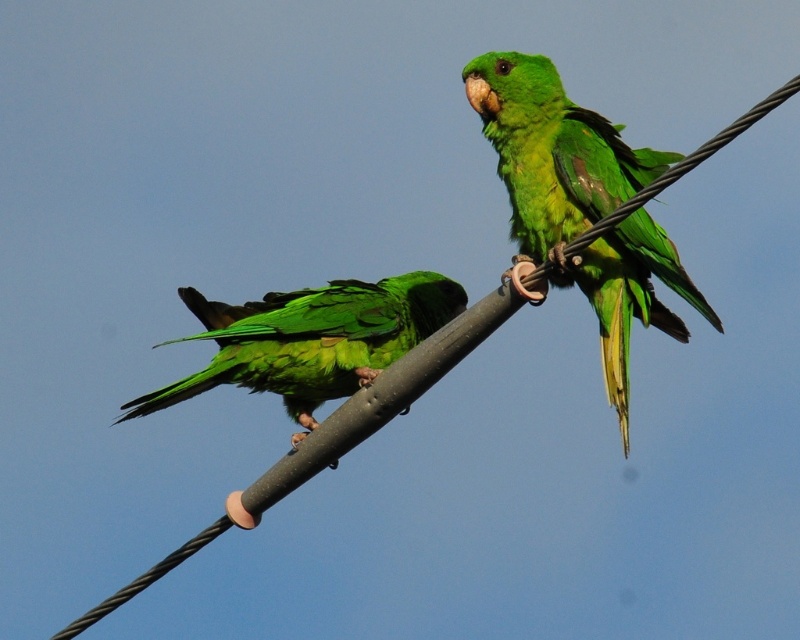
Question: Where is green matte parrot at upper right located in relation to green matte parrot at left in the image?

Choices:
 (A) above
 (B) below

Answer: (A)

Question: Does green matte parrot at upper right appear on the left side of green matte parrot at left?

Choices:
 (A) no
 (B) yes

Answer: (A)

Question: Which of the following is the farthest from the observer?

Choices:
 (A) (393, 317)
 (B) (514, 68)

Answer: (A)

Question: Which point appears closest to the camera in this image?

Choices:
 (A) (314, 426)
 (B) (526, 186)

Answer: (A)

Question: Does green matte parrot at upper right appear on the right side of green matte parrot at left?

Choices:
 (A) yes
 (B) no

Answer: (A)

Question: Which of the following is the closest to the observer?

Choices:
 (A) (598, 250)
 (B) (260, 320)

Answer: (A)